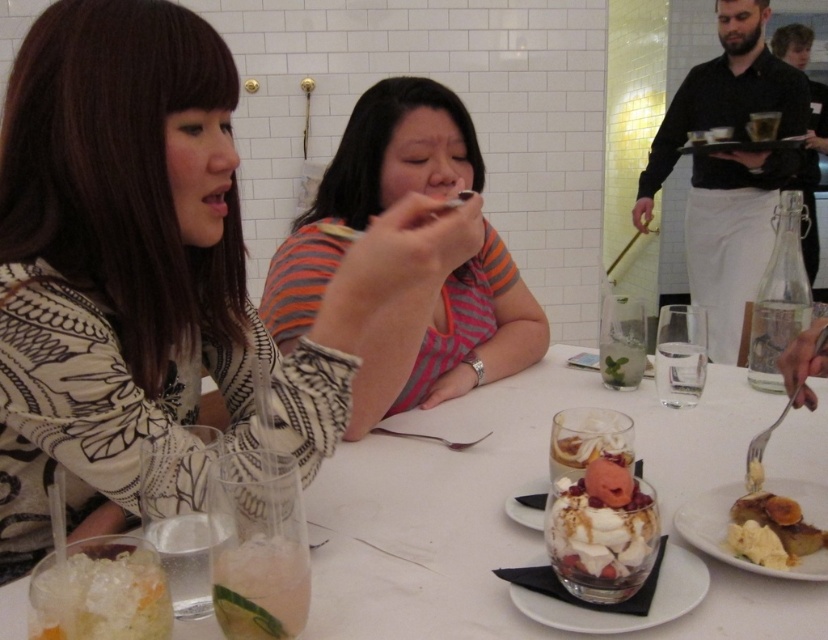
You are a food critic who needs to choose between the clear gelatinous dessert at lower left and the clear glass dessert at center. Which one is bigger?

The clear glass dessert at center is bigger than the clear gelatinous dessert at lower left.

You are a photographer standing behind the striped fabric shirt at center and the whipped cream topped with fruit at center. You want to take a photo of both objects without any obstruction. Which object should you place closer to the camera to ensure both are fully visible?

The striped fabric shirt at center is much taller than the whipped cream topped with fruit at center, so you should place the whipped cream topped with fruit at center closer to the camera to avoid it being blocked by the taller striped fabric shirt at center.